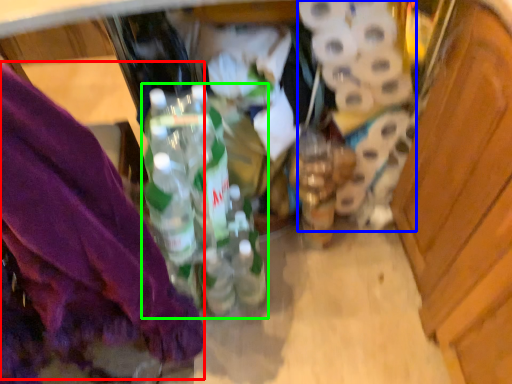
Question: Based on their relative distances, which object is farther from underclothes (highlighted by a red box)? Choose from toilet paper (highlighted by a blue box) and bottle (highlighted by a green box).

Choices:
 (A) toilet paper
 (B) bottle

Answer: (A)